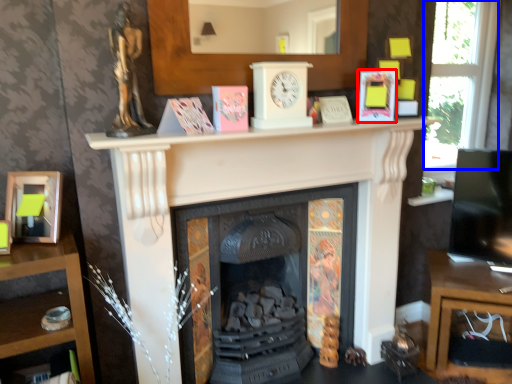
Question: Among these objects, which one is nearest to the camera, paperback book (highlighted by a red box) or window (highlighted by a blue box)?

Choices:
 (A) paperback book
 (B) window

Answer: (A)